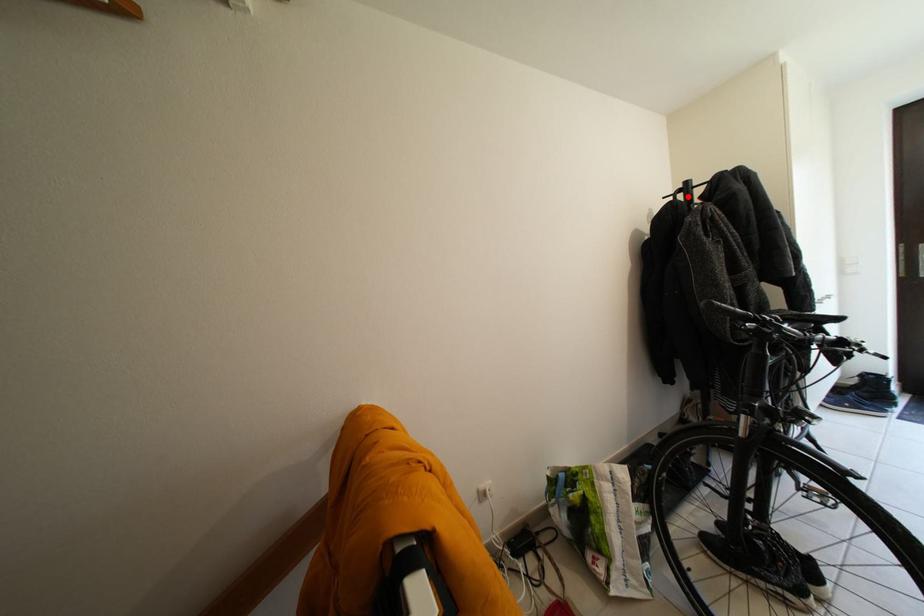
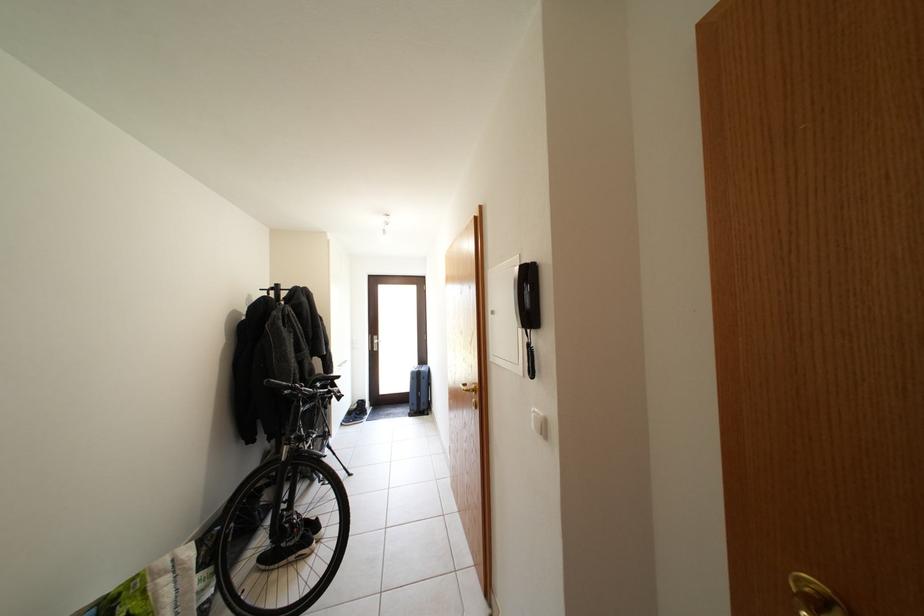
Find the pixel in the second image that matches the highlighted location in the first image.

(281, 294)